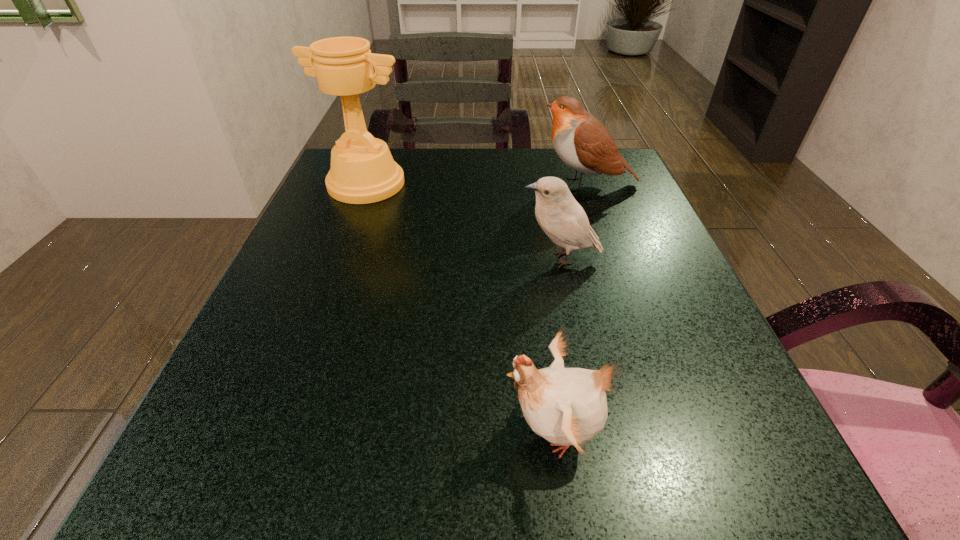
Find the location of `the tallest object`. the tallest object is located at coordinates click(x=362, y=171).

Locate an element on the screen. This screenshot has width=960, height=540. award is located at coordinates (362, 171).

I want to click on the farthest bird, so coord(583,143).

Find the location of a particular element. This screenshot has width=960, height=540. the second farthest bird is located at coordinates (561, 217).

Locate an element on the screen. The height and width of the screenshot is (540, 960). the nearest bird is located at coordinates (567, 406).

This screenshot has width=960, height=540. I want to click on vacant position located on the right of the award, so pyautogui.click(x=565, y=184).

I want to click on vacant space located at the face of the farthest bird, so click(444, 184).

This screenshot has height=540, width=960. Find the location of `free point located 0.270m at the face of the farthest bird`. free point located 0.270m at the face of the farthest bird is located at coordinates (418, 184).

I want to click on free space located 0.330m at the face of the farthest bird, so click(x=392, y=184).

The height and width of the screenshot is (540, 960). In order to click on blank space located at the beak of the third farthest object in this screenshot , I will do `click(301, 258)`.